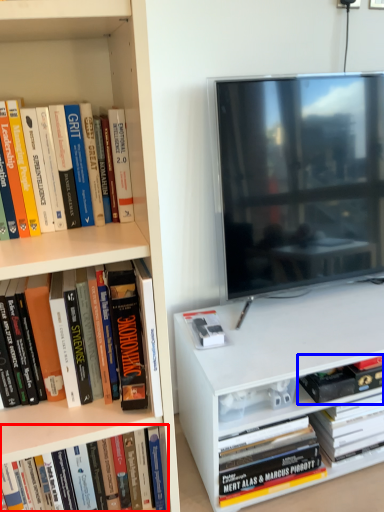
Question: Which point is closer to the camera, book (highlighted by a red box) or book (highlighted by a blue box)?

Choices:
 (A) book
 (B) book

Answer: (A)